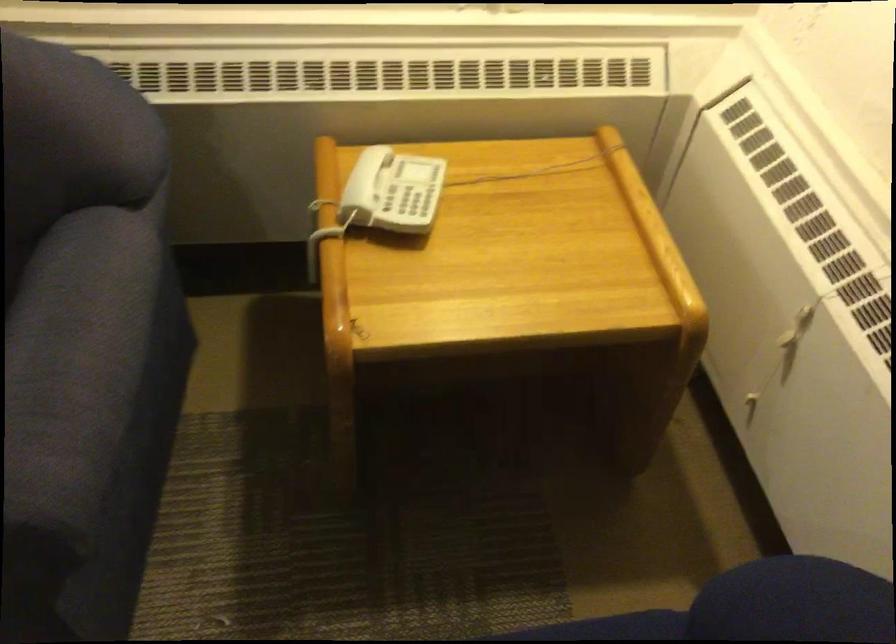
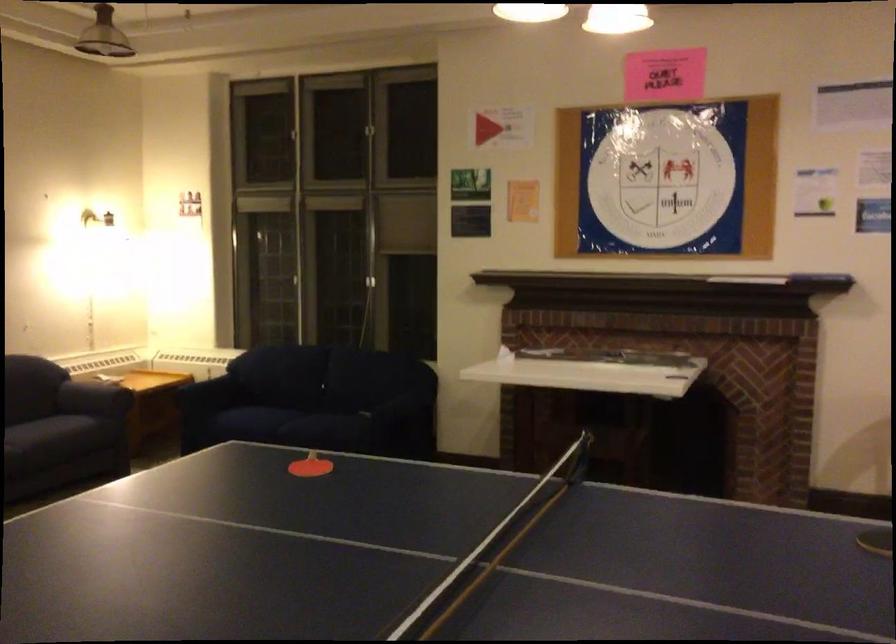
Question: I am providing you with two images of the same scene from different viewpoints. Please identify which objects are invisible in image2.

Choices:
 (A) red ping pong paddle
 (B) cabinet towel bar
 (C) dark sofa armrest
 (D) white telephone handset

Answer: (D)